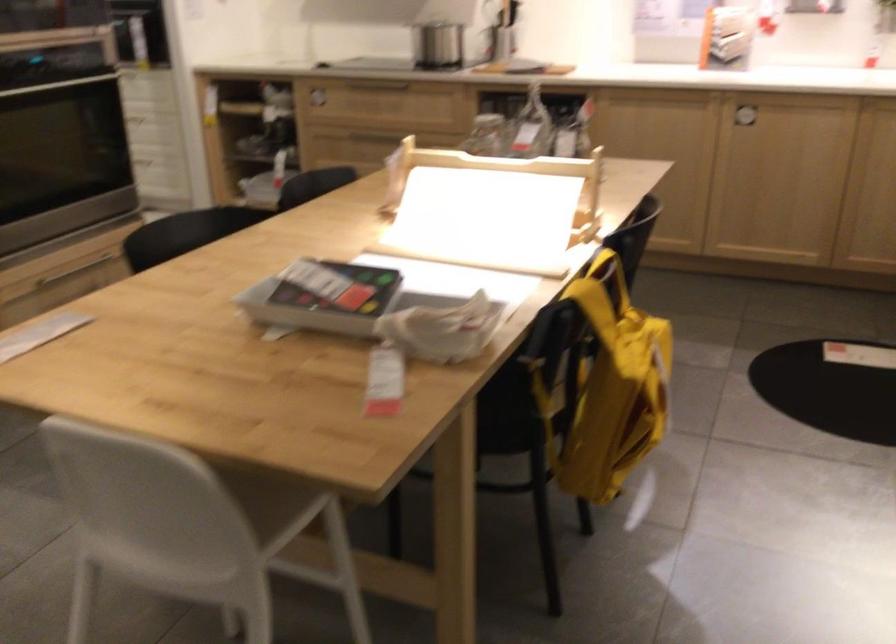
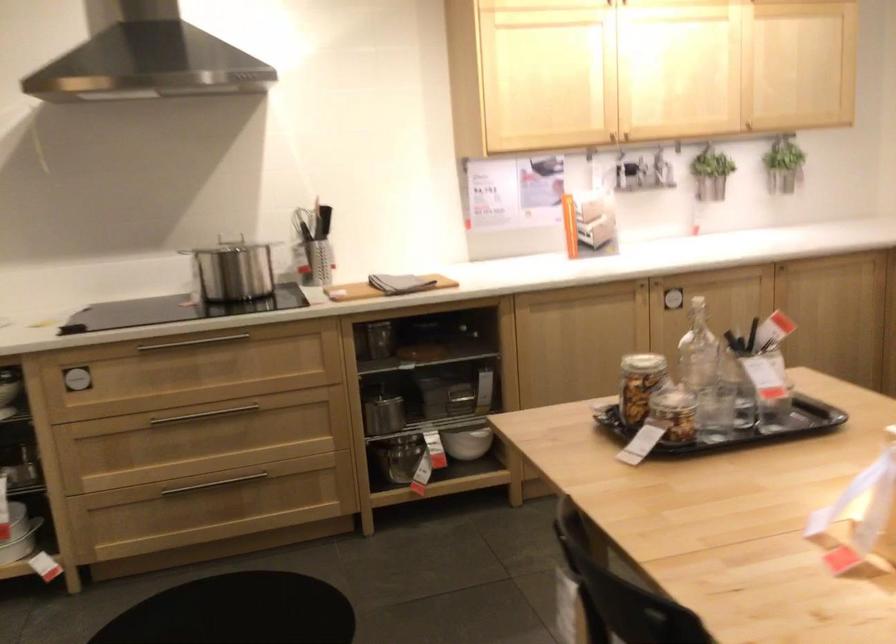
Question: I am providing you with two images of the same scene from different viewpoints. Please identify which objects are invisible in image2.

Choices:
 (A) white bowl
 (B) cabinet knob
 (C) black tray
 (D) none of these

Answer: (D)